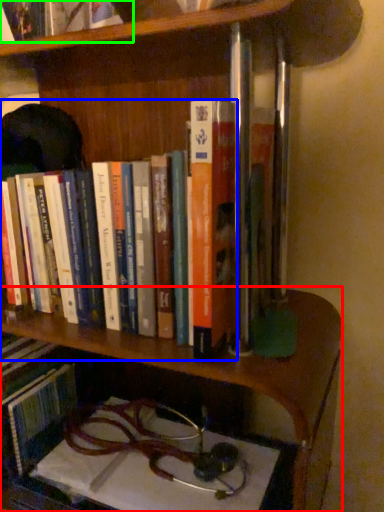
Question: Based on their relative distances, which object is farther from shelf (highlighted by a red box)? Choose from book (highlighted by a blue box) and book (highlighted by a green box).

Choices:
 (A) book
 (B) book

Answer: (B)